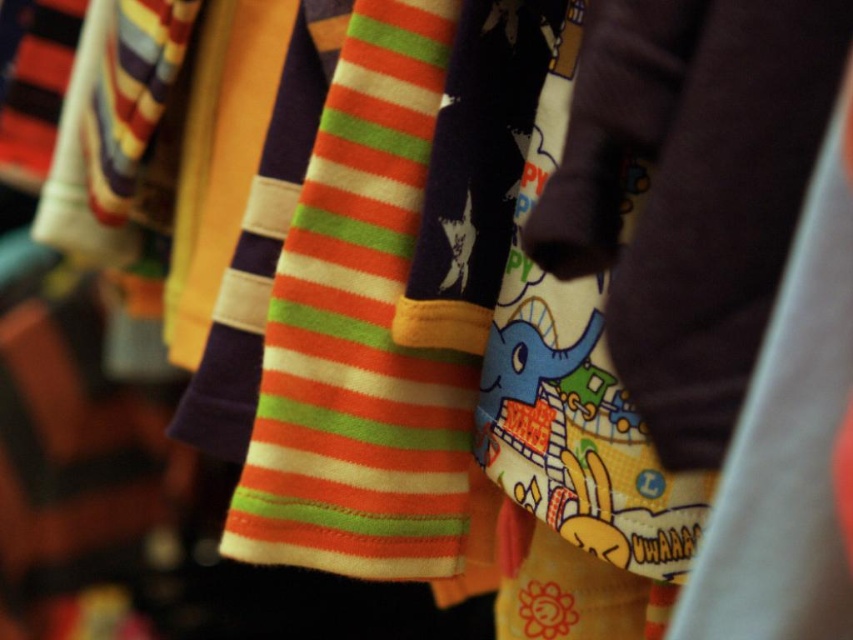
What do you see at coordinates (474, 172) in the screenshot? I see `matte purple tie at center` at bounding box center [474, 172].

Who is positioned more to the right, matte purple tie at center or orange striped fabric at center?

From the viewer's perspective, matte purple tie at center appears more on the right side.

Which is behind, point (405, 320) or point (190, 396)?

The point (190, 396) is behind.

In order to click on matte purple tie at center in this screenshot , I will do `click(474, 172)`.